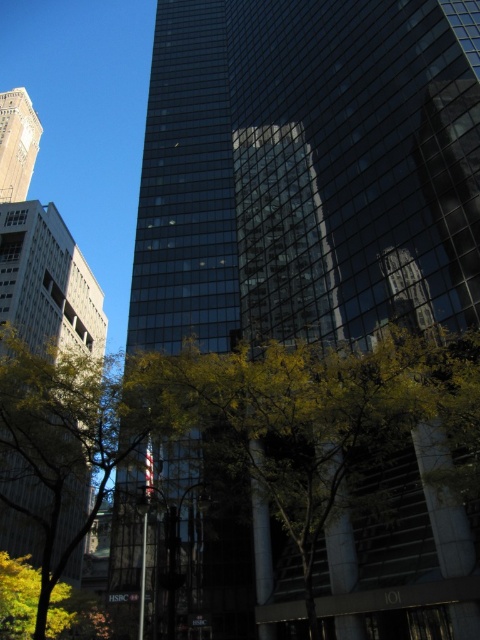
From the picture: You are standing in the city and see the white concrete building at left and the matte gold clock tower at upper left. Which structure is positioned higher in the image?

The matte gold clock tower at upper left is positioned higher in the image than the white concrete building at left.